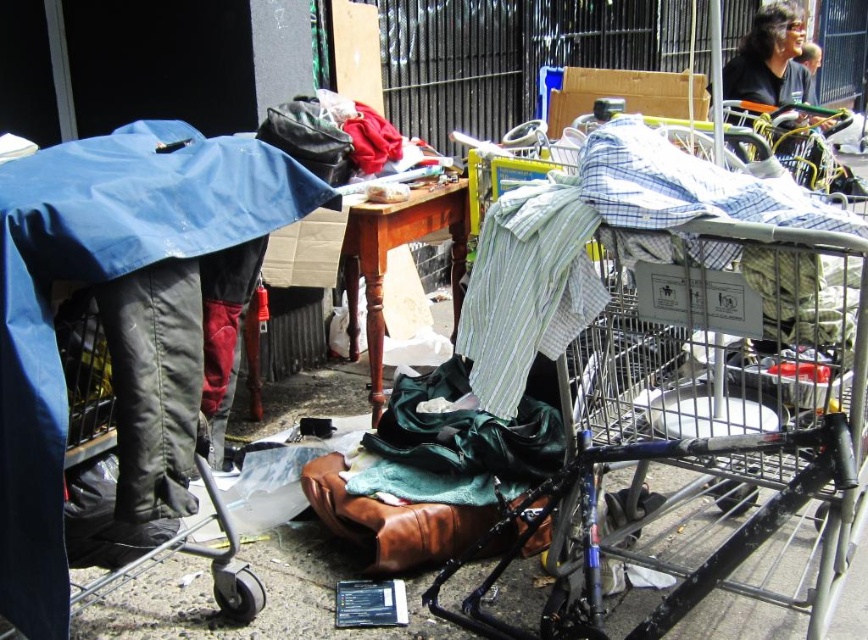
Looking at this image, does metallic silver shopping cart at center right have a greater width compared to black shirt at upper right?

Yes.

From the picture: Can you confirm if metallic silver shopping cart at center right is positioned below black shirt at upper right?

Indeed, metallic silver shopping cart at center right is positioned under black shirt at upper right.

This screenshot has width=868, height=640. I want to click on metallic silver shopping cart at center right, so click(678, 365).

The height and width of the screenshot is (640, 868). I want to click on metallic silver shopping cart at center right, so click(678, 365).